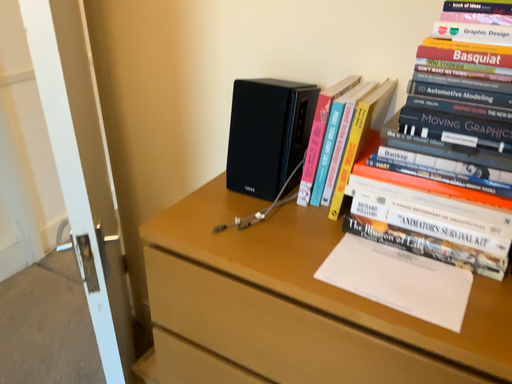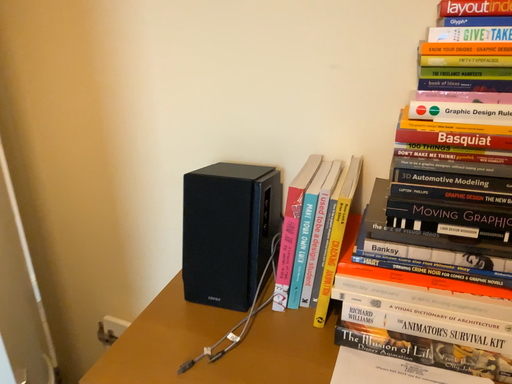
Question: How did the camera likely rotate when shooting the video?

Choices:
 (A) rotated upward
 (B) rotated downward

Answer: (A)